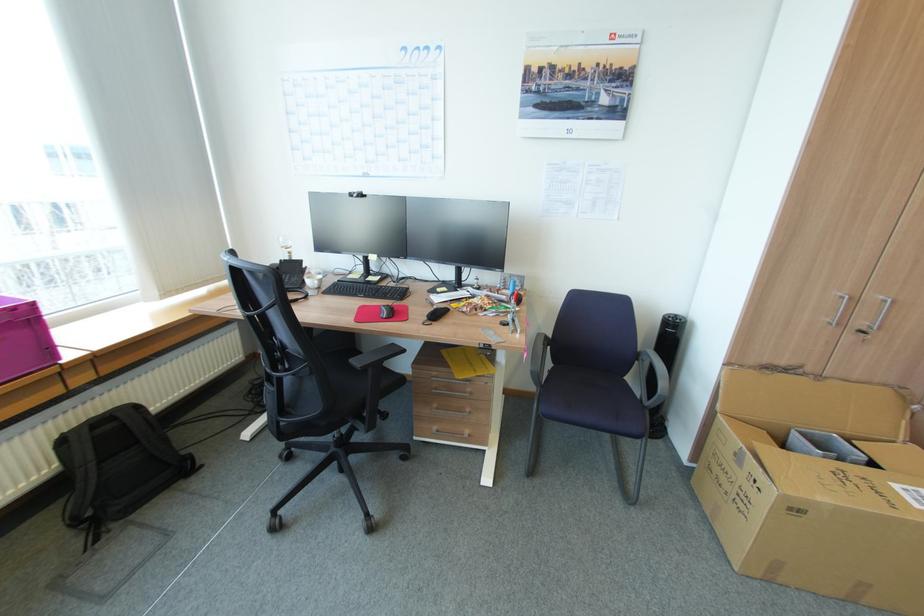
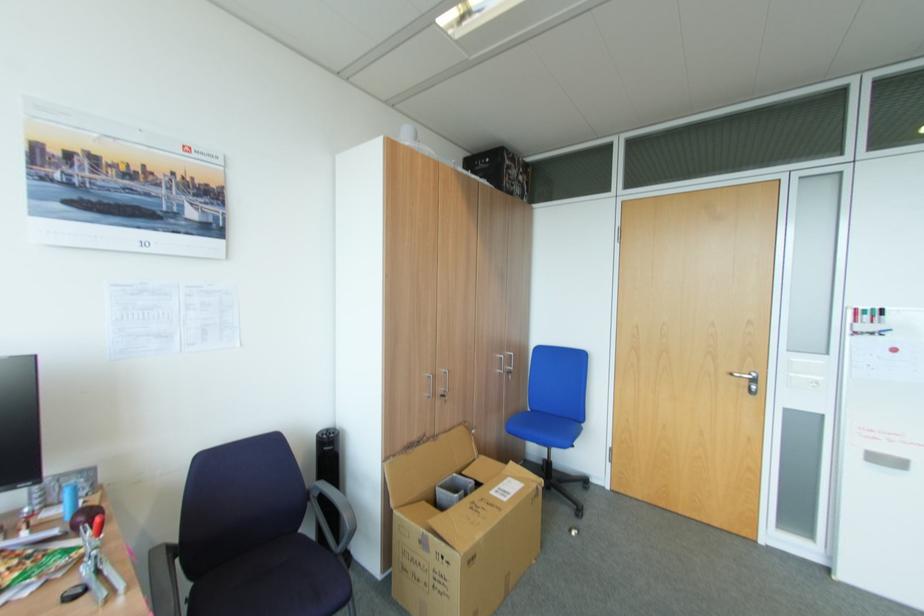
The point at (551, 336) is marked in the first image. Where is the corresponding point in the second image?

(174, 546)